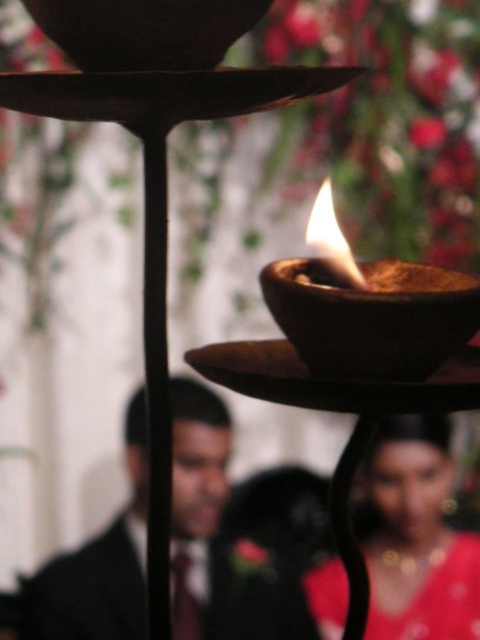
Can you confirm if wooden bowl at center is positioned above matte red dress at center?

Yes, wooden bowl at center is above matte red dress at center.

Does wooden bowl at center have a larger size compared to matte red dress at center?

Actually, wooden bowl at center might be smaller than matte red dress at center.

I want to click on wooden bowl at center, so click(162, 216).

Identify the location of wooden bowl at center. (162, 216).

Does dark suit at center appear on the left side of wooden bowl at center?

Yes, dark suit at center is to the left of wooden bowl at center.

What do you see at coordinates (220, 541) in the screenshot? The image size is (480, 640). I see `dark suit at center` at bounding box center [220, 541].

Where is `dark suit at center`? This screenshot has height=640, width=480. dark suit at center is located at coordinates (220, 541).

Is matte red dress at center to the right of wooden candle holder at center from the viewer's perspective?

A: Indeed, matte red dress at center is positioned on the right side of wooden candle holder at center.

Can you confirm if matte red dress at center is positioned above wooden candle holder at center?

Incorrect, matte red dress at center is not positioned above wooden candle holder at center.

Is point (463, 598) closer to camera compared to point (348, 625)?

No, (463, 598) is behind (348, 625).

Where is `matte red dress at center`? Image resolution: width=480 pixels, height=640 pixels. matte red dress at center is located at coordinates (x=416, y=538).